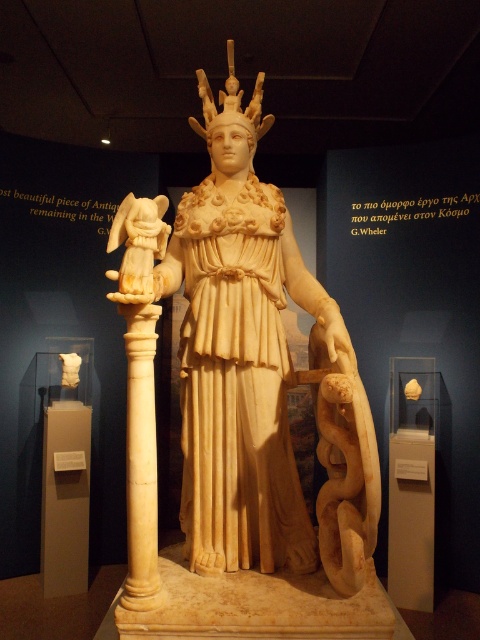
Question: Does white marble statue at center have a greater width compared to white marble pedestal at lower left?

Choices:
 (A) yes
 (B) no

Answer: (A)

Question: Is white marble statue at center thinner than white marble pedestal at lower left?

Choices:
 (A) no
 (B) yes

Answer: (A)

Question: Which point appears closest to the camera in this image?

Choices:
 (A) (50, 563)
 (B) (242, 484)

Answer: (B)

Question: Among these points, which one is farthest from the camera?

Choices:
 (A) (72, 529)
 (B) (210, 410)

Answer: (A)

Question: Considering the relative positions of white marble statue at center and white marble pedestal at lower left in the image provided, where is white marble statue at center located with respect to white marble pedestal at lower left?

Choices:
 (A) above
 (B) below

Answer: (A)

Question: Which of the following is the closest to the observer?

Choices:
 (A) white marble statue at center
 (B) white marble pedestal at lower left

Answer: (A)